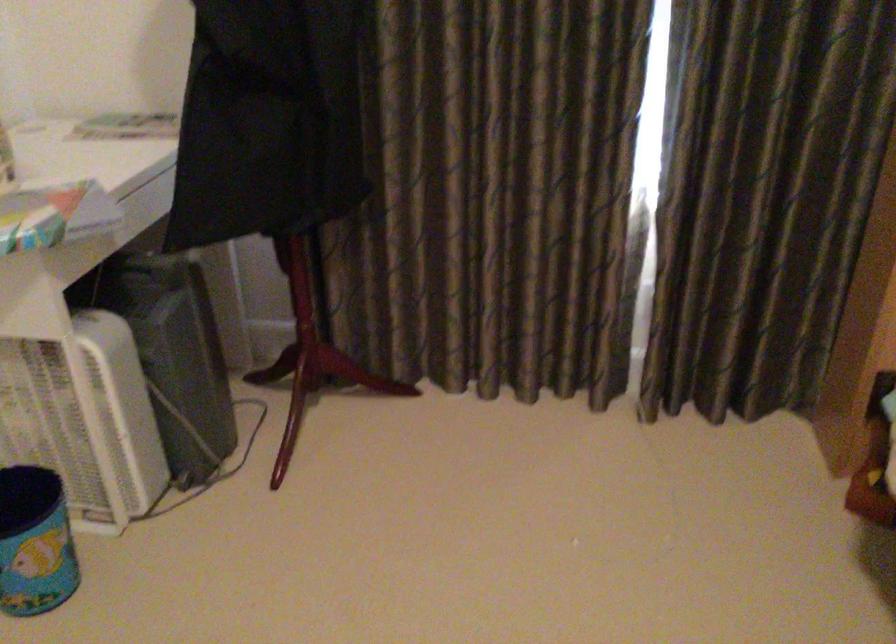
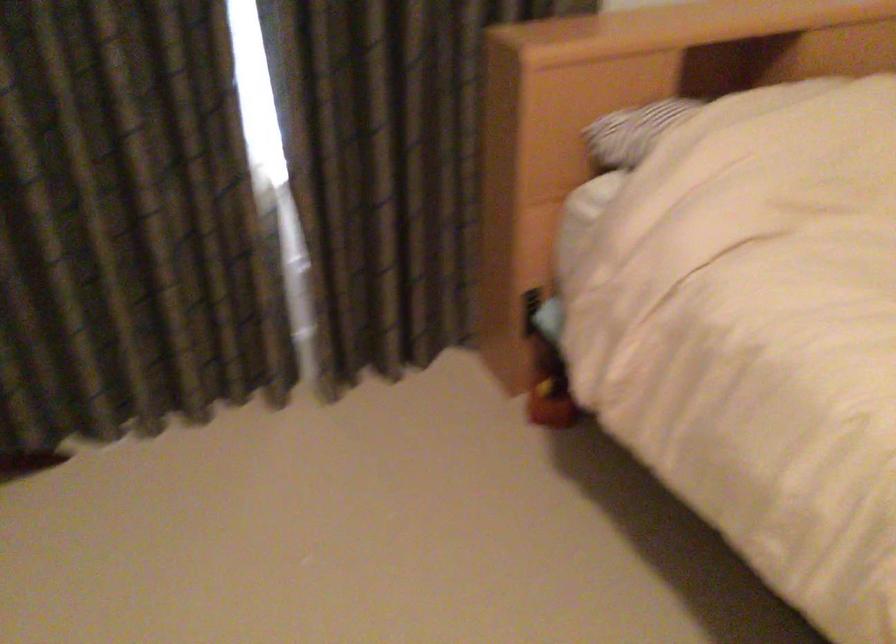
Question: The camera is either moving clockwise (left) or counter-clockwise (right) around the object. The first image is from the beginning of the video and the second image is from the end. Is the camera moving left or right when shooting the video?

Choices:
 (A) Left
 (B) Right

Answer: (A)